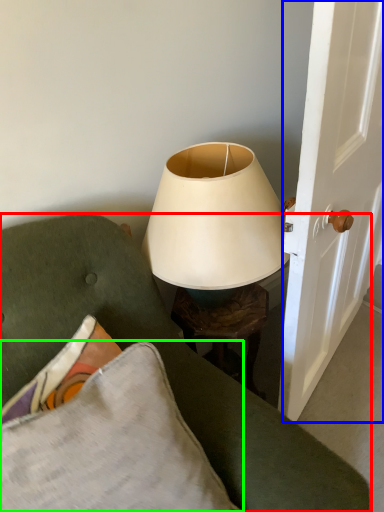
Question: Estimate the real-world distances between objects in this image. Which object is farther from furniture (highlighted by a red box), screen door (highlighted by a blue box) or pillow (highlighted by a green box)?

Choices:
 (A) screen door
 (B) pillow

Answer: (A)